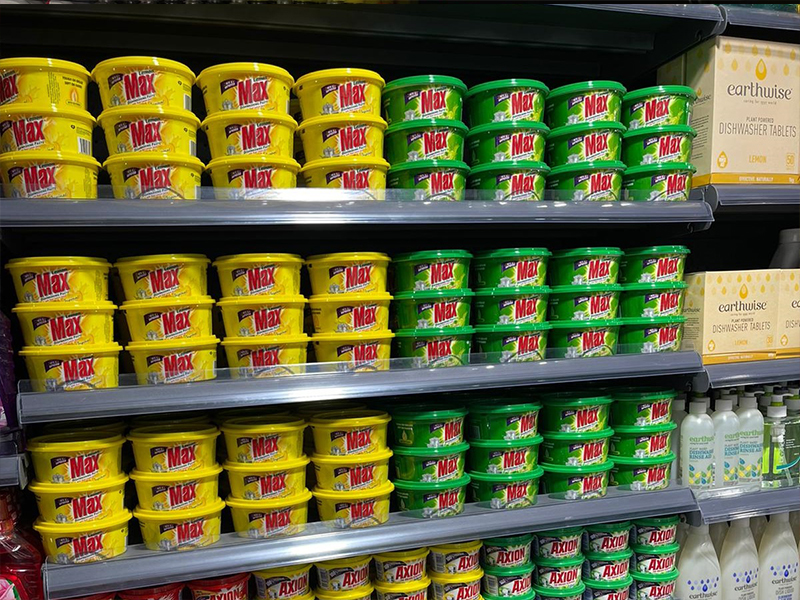
Identify the location of top shelf. (401, 209).